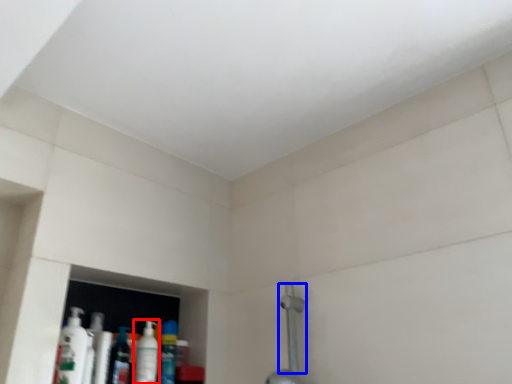
Question: Which object is further to the camera taking this photo, mouthwash (highlighted by a red box) or shower (highlighted by a blue box)?

Choices:
 (A) mouthwash
 (B) shower

Answer: (A)